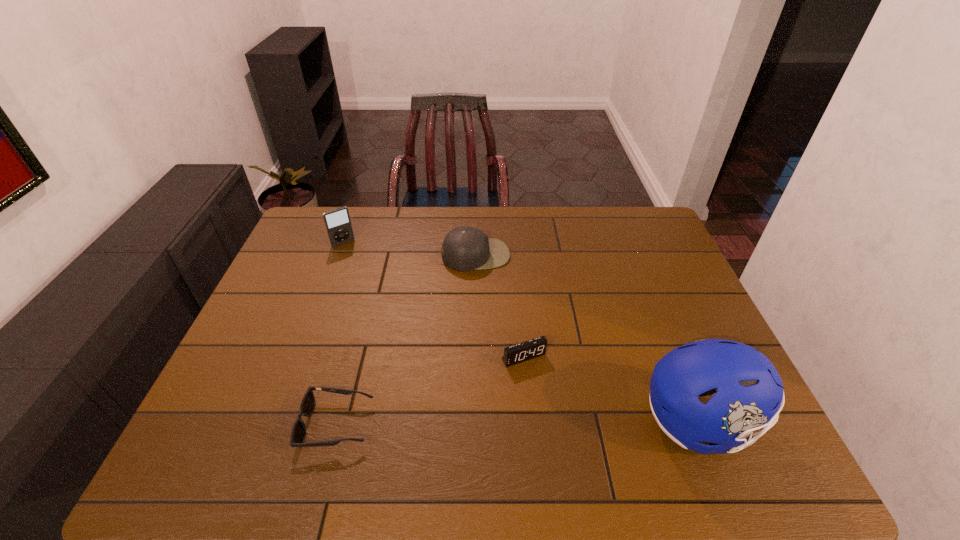
Find the location of a particular element. vacant region at the left edge of the desktop is located at coordinates (307, 278).

In the image, there is a desktop. Where is `blank space at the right edge`? This screenshot has width=960, height=540. blank space at the right edge is located at coordinates (679, 328).

I want to click on blank space at the far right corner of the desktop, so click(x=651, y=217).

At what (x,y) coordinates should I click in order to perform the action: click on free area in between the cap and the tallest object. Please return your answer as a coordinate pair (x, y). The image size is (960, 540). Looking at the image, I should click on (588, 339).

Locate an element on the screen. This screenshot has width=960, height=540. vacant space that's between the fourth shortest object and the second object from left to right is located at coordinates (340, 334).

At what (x,y) coordinates should I click in order to perform the action: click on free spot between the third farthest object and the shortest object. Please return your answer as a coordinate pair (x, y). The height and width of the screenshot is (540, 960). Looking at the image, I should click on (430, 390).

This screenshot has height=540, width=960. Find the location of `vacant area that lies between the tallest object and the fourth object from right to left`. vacant area that lies between the tallest object and the fourth object from right to left is located at coordinates (518, 423).

The width and height of the screenshot is (960, 540). Find the location of `free spot between the shortest object and the second tallest object`. free spot between the shortest object and the second tallest object is located at coordinates (340, 334).

At what (x,y) coordinates should I click in order to perform the action: click on vacant space that's between the rightmost object and the cap. Please return your answer as a coordinate pair (x, y). Looking at the image, I should click on (588, 339).

You are a GUI agent. You are given a task and a screenshot of the screen. Output one action in this format:
    pyautogui.click(x=<x>, y=<y>)
    Task: Click on the vacant space that's between the third shortest object and the alarm clock
    This screenshot has width=960, height=540.
    Given the screenshot: What is the action you would take?
    pyautogui.click(x=500, y=306)